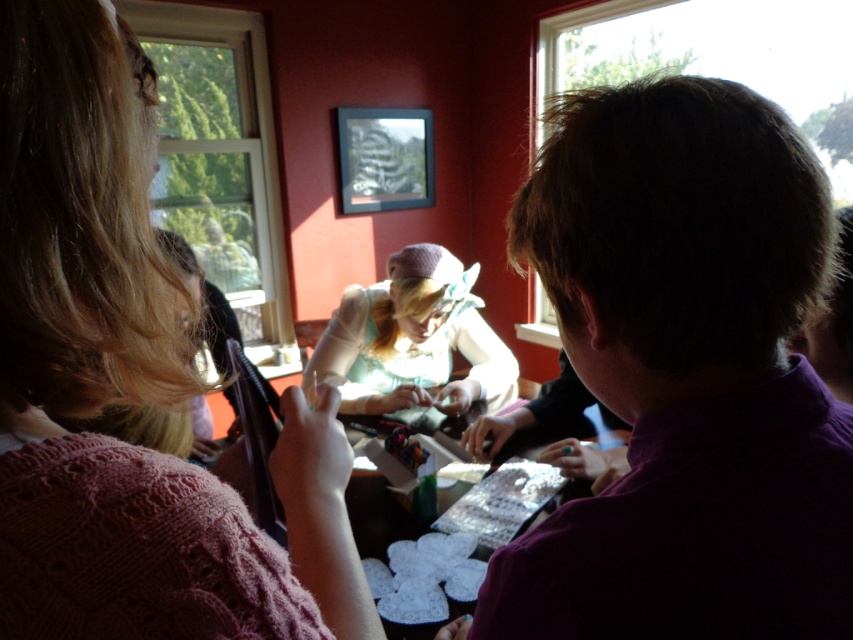
Which is more to the left, purple shirt at right or knitted pink sweater at left?

Positioned to the left is knitted pink sweater at left.

Can you confirm if purple shirt at right is bigger than knitted pink sweater at left?

A: Yes, purple shirt at right is bigger than knitted pink sweater at left.

Does point (654, 604) lie behind point (323, 516)?

No, (654, 604) is in front of (323, 516).

Where is `purple shirt at right`? This screenshot has width=853, height=640. purple shirt at right is located at coordinates (683, 374).

Which is below, knitted pink sweater at left or light blue fabric at center?

light blue fabric at center

Can you confirm if knitted pink sweater at left is wider than light blue fabric at center?

Incorrect, knitted pink sweater at left's width does not surpass light blue fabric at center's.

The image size is (853, 640). Describe the element at coordinates (128, 388) in the screenshot. I see `knitted pink sweater at left` at that location.

At what (x,y) coordinates should I click in order to perform the action: click on knitted pink sweater at left. Please return your answer as a coordinate pair (x, y). Looking at the image, I should click on (128, 388).

Is purple shirt at right further to camera compared to light blue fabric at center?

No, purple shirt at right is in front of light blue fabric at center.

Is purple shirt at right shorter than light blue fabric at center?

Yes.

This screenshot has height=640, width=853. Identify the location of purple shirt at right. (683, 374).